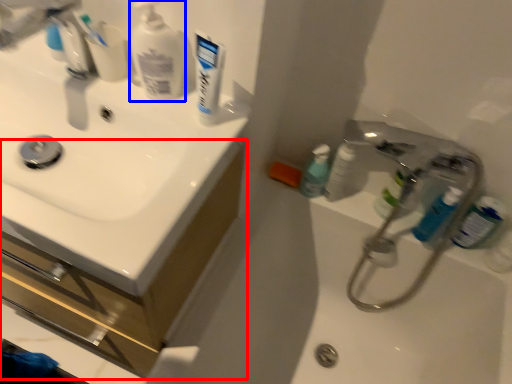
Question: Which of the following is the farthest to the observer, bathroom cabinet (highlighted by a red box) or cleaning product (highlighted by a blue box)?

Choices:
 (A) bathroom cabinet
 (B) cleaning product

Answer: (A)